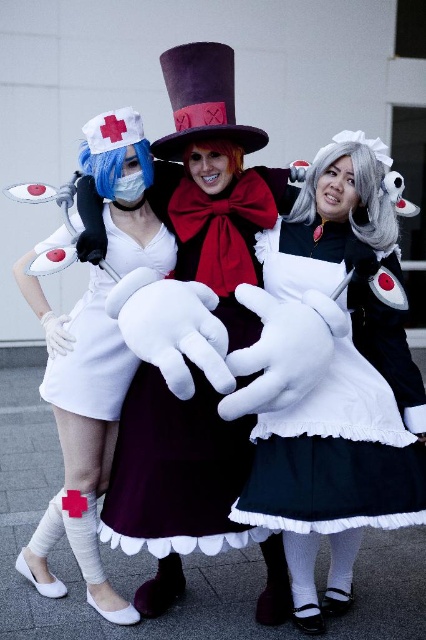
Does black satin dress at center come in front of white matte dress at center?

Yes, black satin dress at center is in front of white matte dress at center.

Can you confirm if black satin dress at center is wider than white matte dress at center?

Indeed, black satin dress at center has a greater width compared to white matte dress at center.

Which is in front, point (354, 380) or point (120, 339)?

Point (354, 380)

I want to click on black satin dress at center, so click(x=345, y=438).

Can you confirm if white matte nurse outfit at left is taller than white matte dress at center?

Yes, white matte nurse outfit at left is taller than white matte dress at center.

Which is behind, point (131, 205) or point (49, 380)?

Positioned behind is point (131, 205).

Find the location of a particular element. white matte nurse outfit at left is located at coordinates pyautogui.click(x=78, y=428).

Does maroon satin dress at center have a greater width compared to white matte dress at center?

Yes, maroon satin dress at center is wider than white matte dress at center.

Between point (198, 452) and point (109, 396), which one is positioned behind?

Positioned behind is point (109, 396).

In order to click on maroon satin dress at center in this screenshot , I will do `click(175, 472)`.